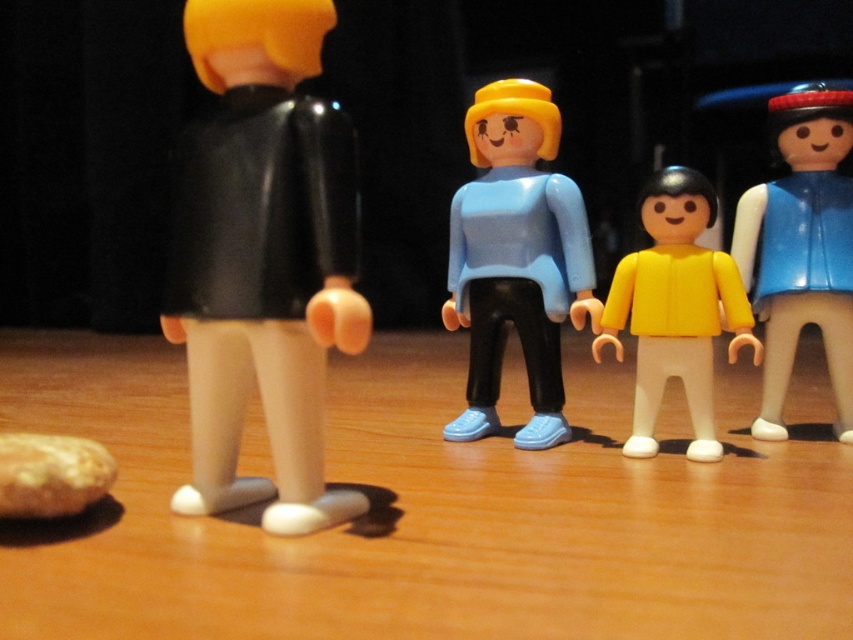
Question: Which is nearer to the yellow matte figure at center?

Choices:
 (A) blue glossy vest at right
 (B) matte blue plastic figure at center
 (C) matte black figure at left

Answer: (B)

Question: Is matte black figure at left below blue glossy vest at right?

Choices:
 (A) no
 (B) yes

Answer: (B)

Question: Does matte black figure at left appear on the left side of blue glossy vest at right?

Choices:
 (A) no
 (B) yes

Answer: (B)

Question: Estimate the real-world distances between objects in this image. Which object is farther from the matte black figure at left?

Choices:
 (A) yellow matte figure at center
 (B) blue glossy vest at right
 (C) matte blue plastic figure at center

Answer: (B)

Question: Which of the following is the closest to the observer?

Choices:
 (A) matte black figure at left
 (B) matte blue plastic figure at center
 (C) blue glossy vest at right
 (D) yellow matte figure at center

Answer: (A)

Question: Can you confirm if matte black figure at left is bigger than yellow matte figure at center?

Choices:
 (A) yes
 (B) no

Answer: (A)